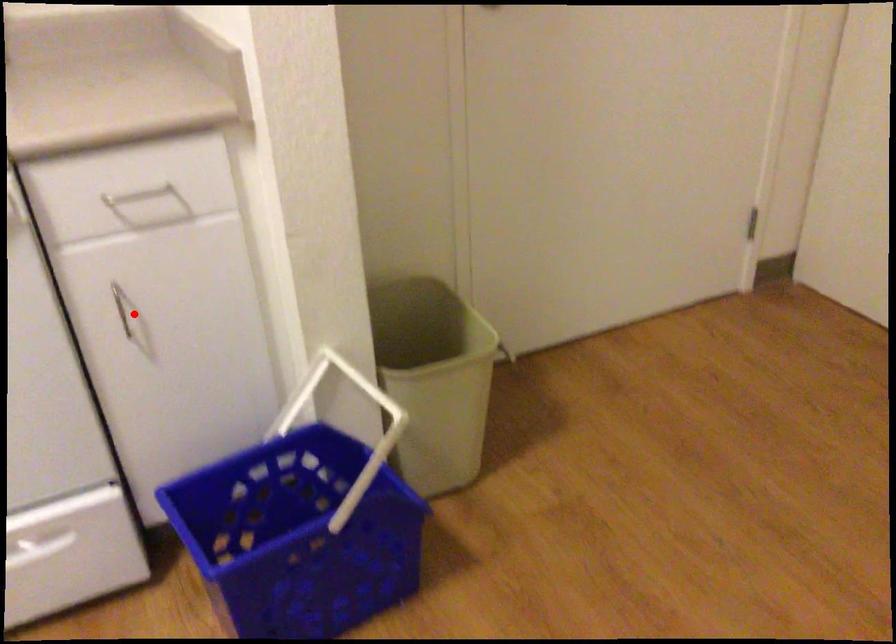
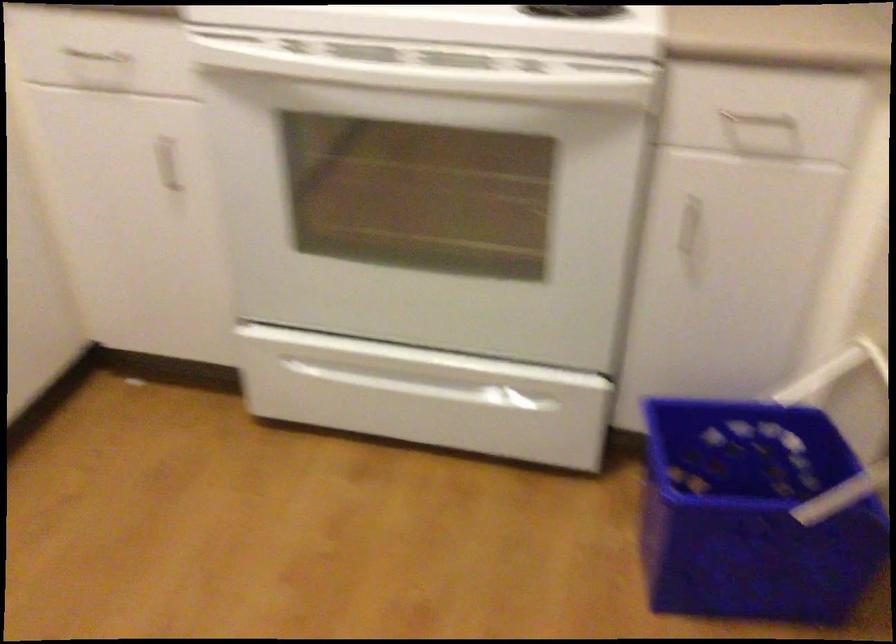
The point at the highlighted location is marked in the first image. Where is the corresponding point in the second image?

(691, 228)